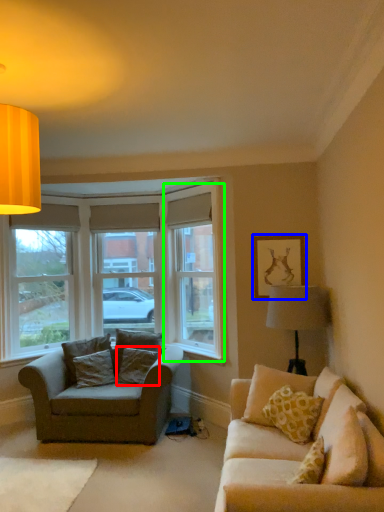
Question: Which is nearer to the pillow (highlighted by a red box)? picture frame (highlighted by a blue box) or window screen (highlighted by a green box).

Choices:
 (A) picture frame
 (B) window screen

Answer: (B)